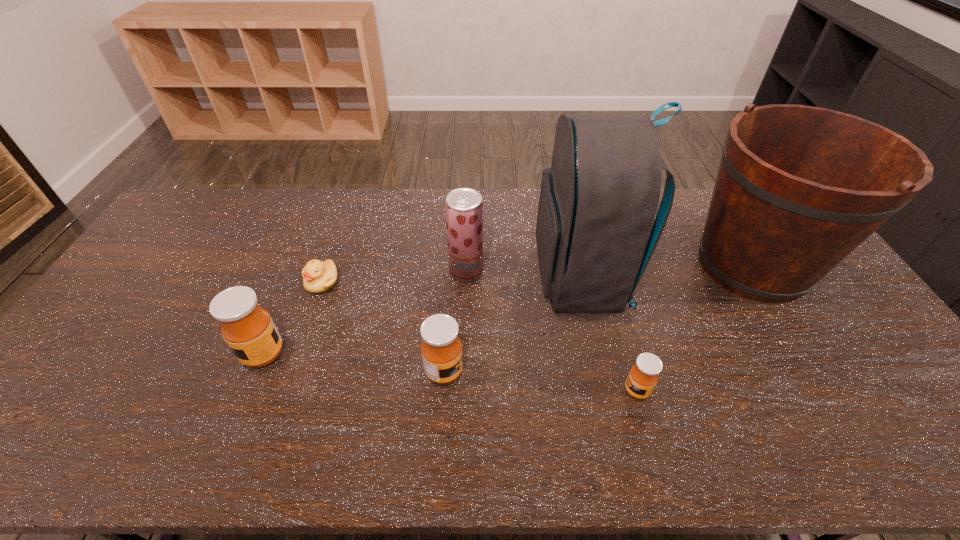
You are a GUI agent. You are given a task and a screenshot of the screen. Output one action in this format:
    pyautogui.click(x=<x>, y=<y>)
    Task: Click on the vacant spot to place a honey on the right
    The height and width of the screenshot is (540, 960).
    Given the screenshot: What is the action you would take?
    pyautogui.click(x=843, y=410)